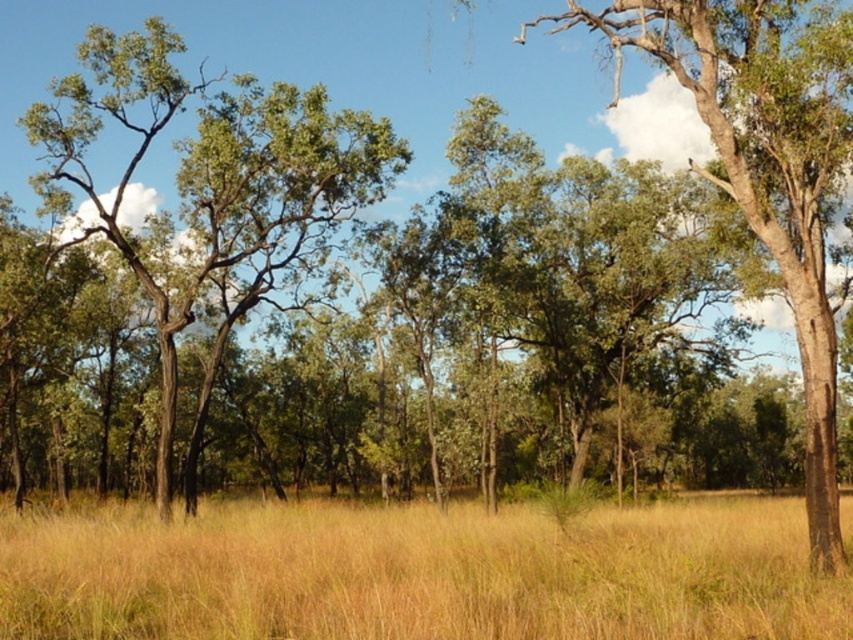
Is yellow grass at center bigger than green leafy tree at left?

No.

Between point (387, 528) and point (335, 131), which one is positioned behind?

Positioned behind is point (335, 131).

The image size is (853, 640). I want to click on yellow grass at center, so click(x=421, y=573).

The image size is (853, 640). What do you see at coordinates (210, 176) in the screenshot? I see `green leafy tree at left` at bounding box center [210, 176].

Which is in front, point (148, 77) or point (780, 81)?

Point (780, 81)

Find the location of a particular element. Image resolution: width=853 pixels, height=640 pixels. green leafy tree at left is located at coordinates pos(210,176).

Is yellow grass at center in front of green leafy tree at center?

Yes.

Is yellow grass at center shorter than green leafy tree at center?

Yes, yellow grass at center is shorter than green leafy tree at center.

What do you see at coordinates (421, 573) in the screenshot?
I see `yellow grass at center` at bounding box center [421, 573].

This screenshot has width=853, height=640. What are the coordinates of `yellow grass at center` in the screenshot? It's located at click(x=421, y=573).